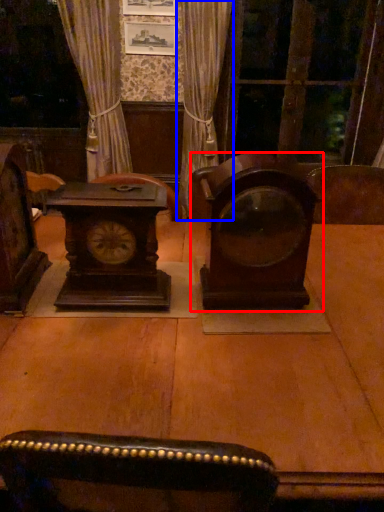
Question: Which object is closer to the camera taking this photo, alarm clock (highlighted by a red box) or curtain (highlighted by a blue box)?

Choices:
 (A) alarm clock
 (B) curtain

Answer: (A)